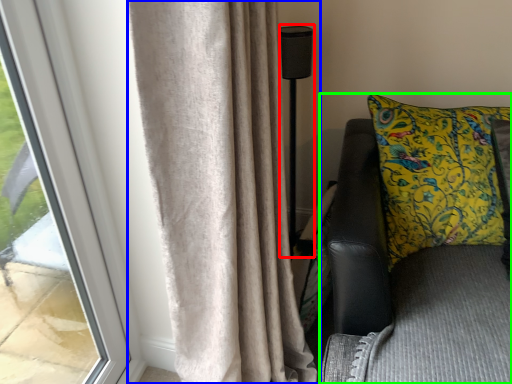
Question: Which object is the farthest from lamp (highlighted by a red box)? Choose among these: curtain (highlighted by a blue box) or furniture (highlighted by a green box).

Choices:
 (A) curtain
 (B) furniture

Answer: (A)